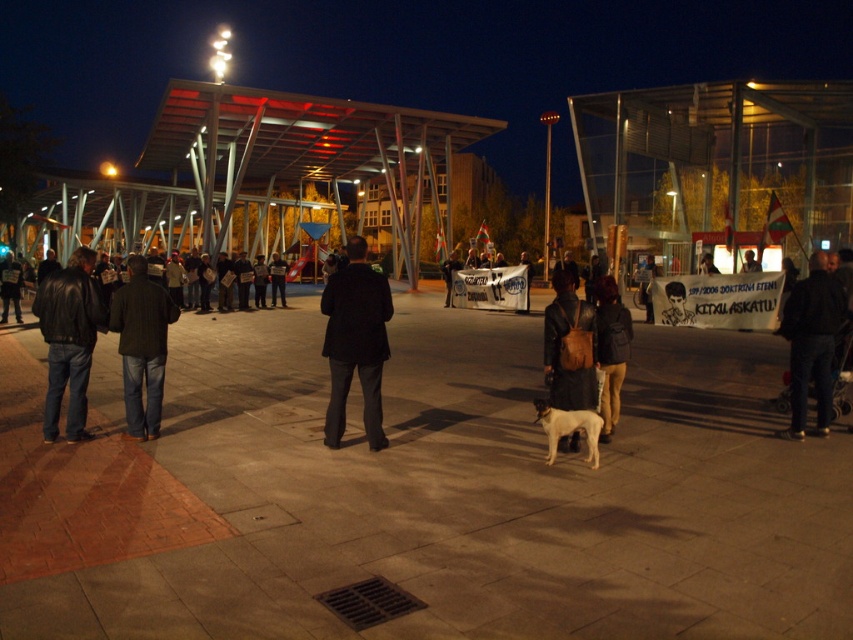
Question: Does black leather jacket at lower right have a larger size compared to dark brown leather jacket at left?

Choices:
 (A) no
 (B) yes

Answer: (A)

Question: Can you confirm if brown leather jacket at center is smaller than dark blue jeans at center?

Choices:
 (A) no
 (B) yes

Answer: (B)

Question: Does brown leather jacket at center appear under dark blue jeans at center?

Choices:
 (A) yes
 (B) no

Answer: (A)

Question: Which object is positioned closest to the black leather jacket at lower right?

Choices:
 (A) dark gray coat at center
 (B) leather backpack at center
 (C) leather jacket at left

Answer: (B)

Question: Which of the following is the farthest from the observer?

Choices:
 (A) dark blue jeans at left
 (B) dark brown leather jacket at left

Answer: (B)

Question: Which point appears closest to the camera in this image?

Choices:
 (A) (276, 278)
 (B) (131, 401)
 (C) (552, 442)
 (D) (599, 412)

Answer: (C)